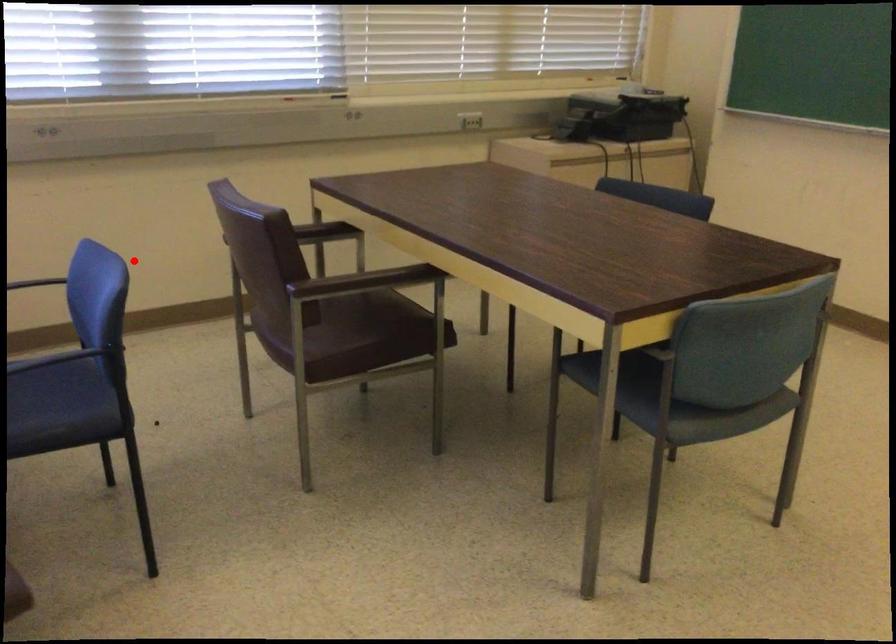
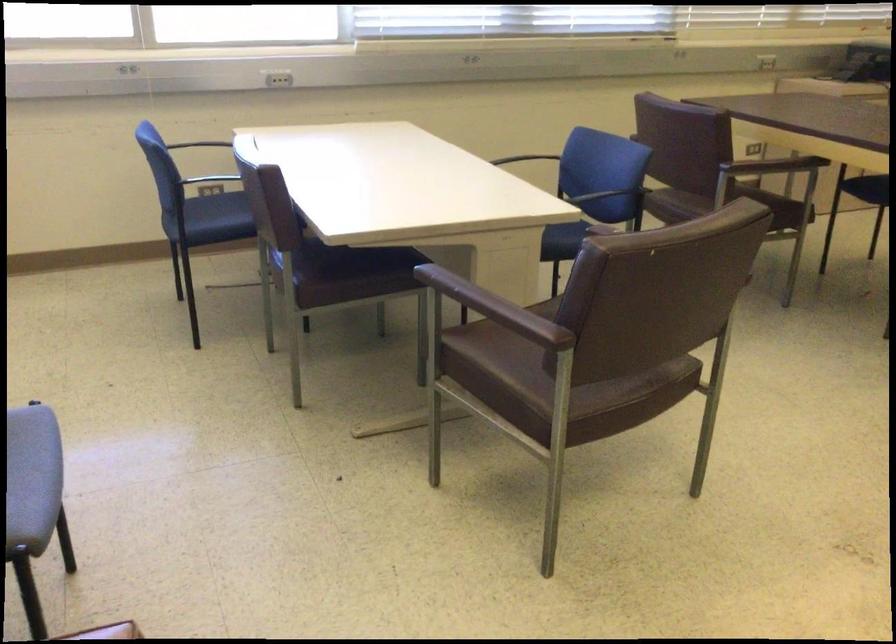
Where in the second image is the point corresponding to the highlighted location from the first image?

(521, 158)